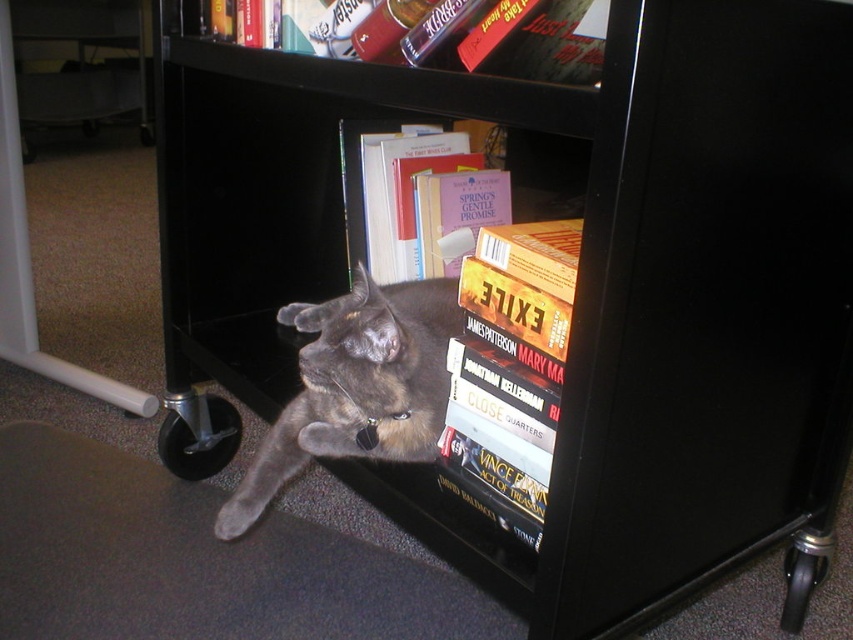
From the picture: Does gray fur cat at lower center have a greater width compared to gray fur cat at center?

Correct, the width of gray fur cat at lower center exceeds that of gray fur cat at center.

What do you see at coordinates (195, 561) in the screenshot? Image resolution: width=853 pixels, height=640 pixels. I see `gray fur cat at lower center` at bounding box center [195, 561].

You are a GUI agent. You are given a task and a screenshot of the screen. Output one action in this format:
    pyautogui.click(x=<x>, y=<y>)
    Task: Click on the gray fur cat at lower center
    Image resolution: width=853 pixels, height=640 pixels.
    Given the screenshot: What is the action you would take?
    pyautogui.click(x=195, y=561)